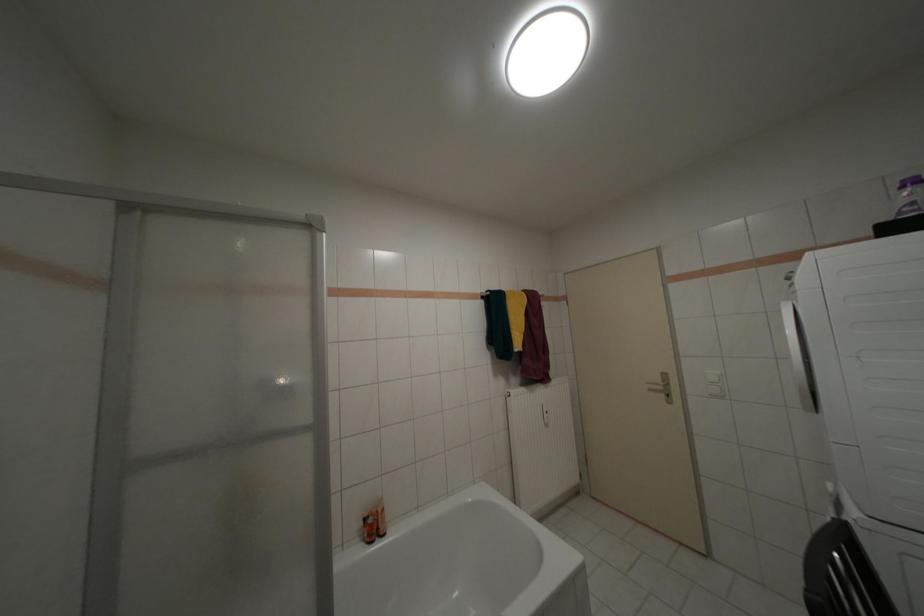
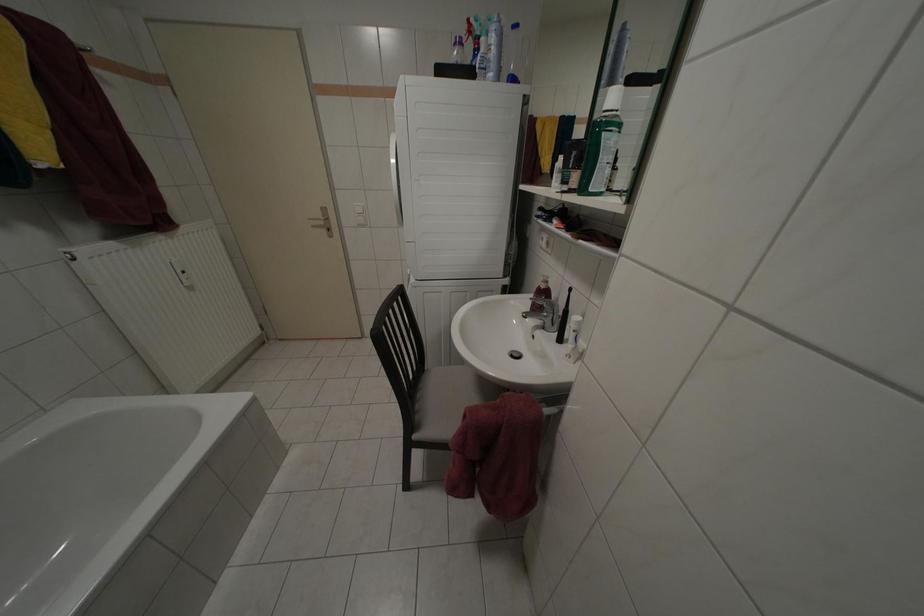
The first image is from the beginning of the video and the second image is from the end. How did the camera likely rotate when shooting the video?

The camera rotated toward right-down.